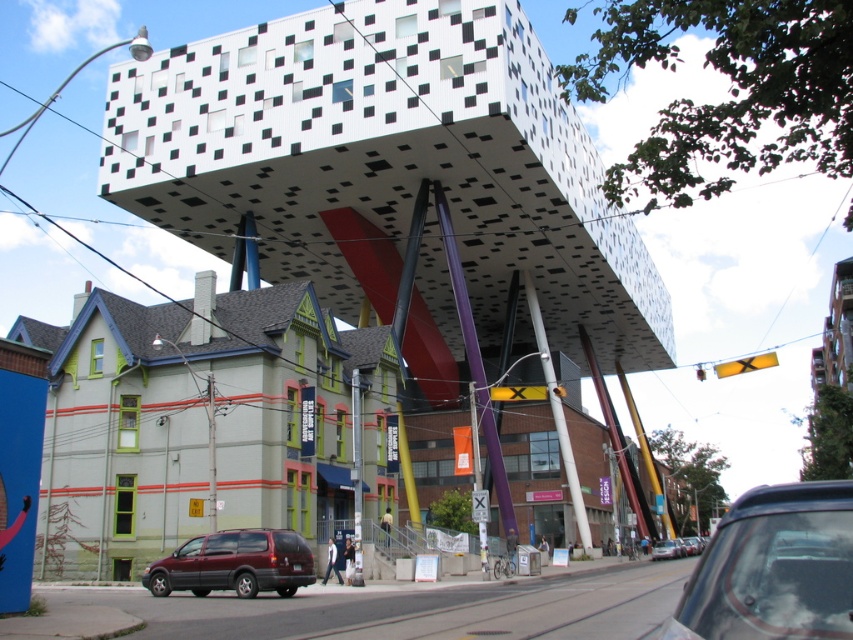
Question: Is white textured cube at upper center positioned before maroon matte suv at lower left?

Choices:
 (A) no
 (B) yes

Answer: (A)

Question: Which of these objects is positioned farthest from the metallic silver car at center?

Choices:
 (A) matte black car at lower right
 (B) white textured cube at upper center

Answer: (A)

Question: Which of the following is the closest to the observer?

Choices:
 (A) (463, 237)
 (B) (289, 580)
 (C) (654, 557)

Answer: (B)

Question: Does white textured cube at upper center appear under matte black car at lower right?

Choices:
 (A) yes
 (B) no

Answer: (B)

Question: Which point is farther to the camera?

Choices:
 (A) matte black car at lower right
 (B) maroon matte suv at lower left
 (C) metallic silver car at center
 (D) white textured cube at upper center

Answer: (C)

Question: Observing the image, what is the correct spatial positioning of maroon matte suv at lower left in reference to metallic silver car at center?

Choices:
 (A) left
 (B) right

Answer: (A)